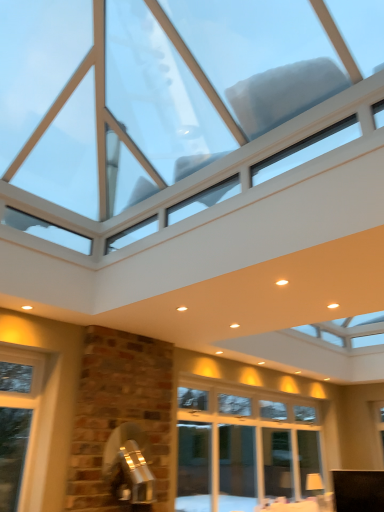
Question: Looking at the image, does black fabric cabinet at lower right seem bigger or smaller compared to transparent glass window at upper center?

Choices:
 (A) small
 (B) big

Answer: (A)

Question: Is black fabric cabinet at lower right inside or outside of transparent glass window at upper center?

Choices:
 (A) outside
 (B) inside

Answer: (A)

Question: From the image's perspective, is black fabric cabinet at lower right located above or below transparent glass window at upper center?

Choices:
 (A) above
 (B) below

Answer: (B)

Question: Relative to black fabric cabinet at lower right, is transparent glass window at upper center in front or behind?

Choices:
 (A) front
 (B) behind

Answer: (A)

Question: From a real-world perspective, relative to black fabric cabinet at lower right, is transparent glass window at upper center vertically above or below?

Choices:
 (A) below
 (B) above

Answer: (B)

Question: In terms of height, does transparent glass window at upper center look taller or shorter compared to black fabric cabinet at lower right?

Choices:
 (A) short
 (B) tall

Answer: (B)

Question: From the image's perspective, is transparent glass window at upper center above or below black fabric cabinet at lower right?

Choices:
 (A) above
 (B) below

Answer: (A)